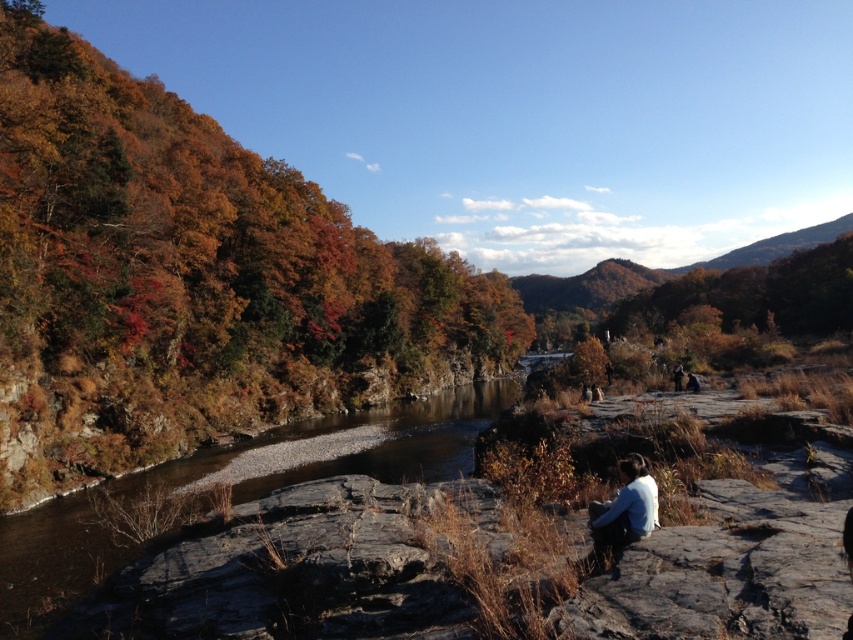
You are standing at the edge of the brown rocky creek at center and looking towards the white cotton shirt at lower center. Which object is closer to your current position?

The white cotton shirt at lower center is closer to your current position because it is above the brown rocky creek at center, which is located below it.